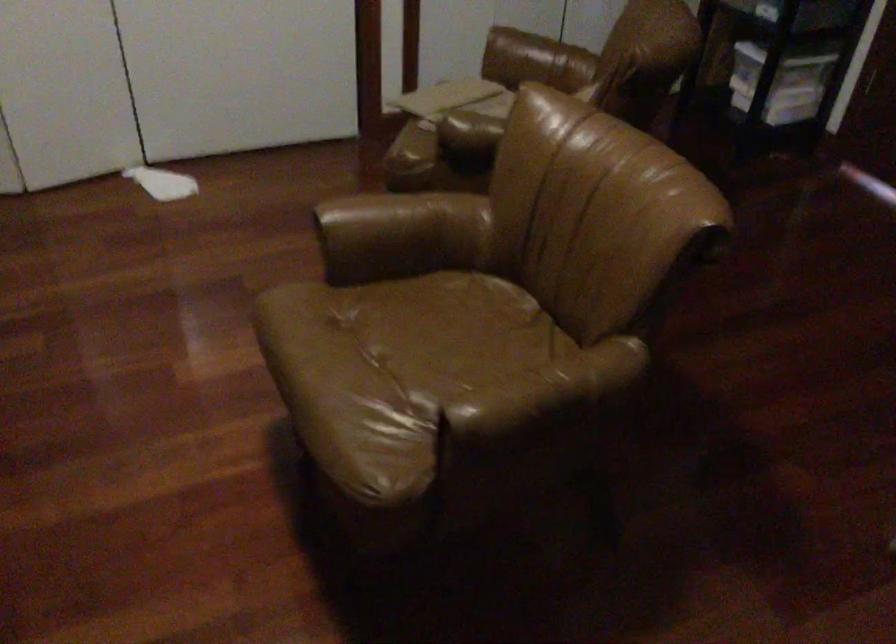
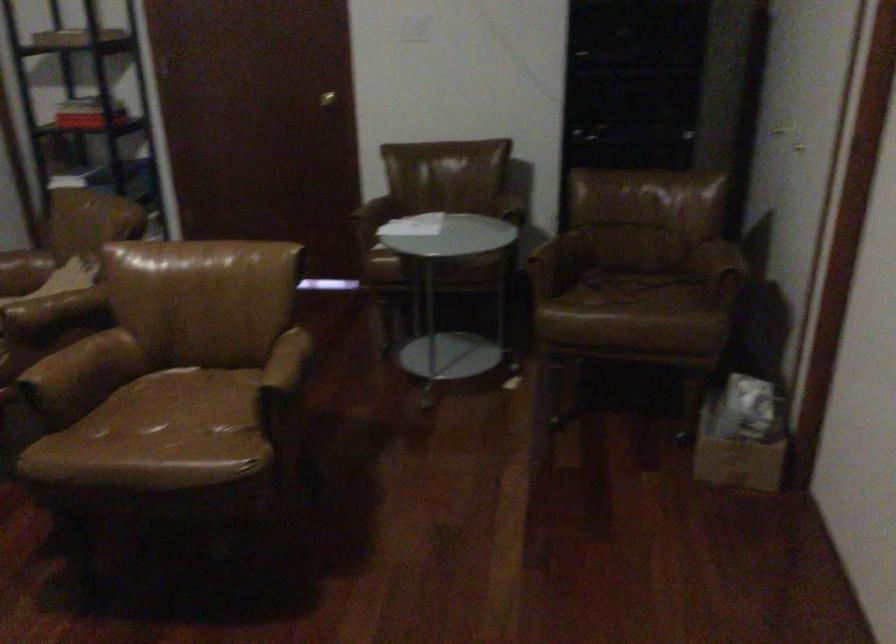
The point at (381,212) is marked in the first image. Where is the corresponding point in the second image?

(61, 361)